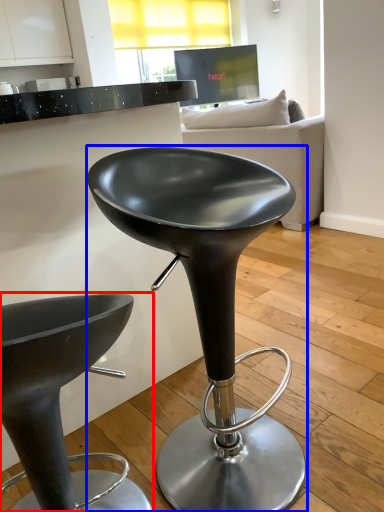
Question: Which point is closer to the camera, stool (highlighted by a red box) or stool (highlighted by a blue box)?

Choices:
 (A) stool
 (B) stool

Answer: (A)